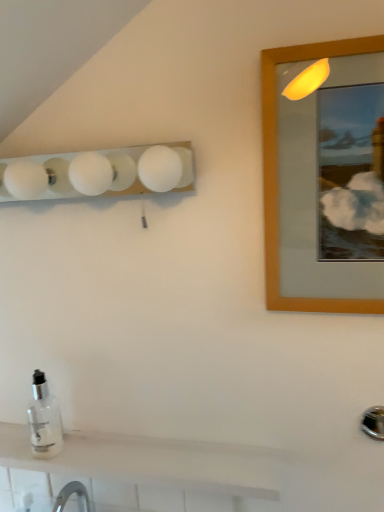
Question: Considering the relative sizes of wooden-framed mirror at upper right and white frosted glass light fixture at upper left in the image provided, is wooden-framed mirror at upper right taller than white frosted glass light fixture at upper left?

Choices:
 (A) yes
 (B) no

Answer: (A)

Question: Is wooden-framed mirror at upper right positioned with its back to white frosted glass light fixture at upper left?

Choices:
 (A) yes
 (B) no

Answer: (B)

Question: Can white frosted glass light fixture at upper left be found inside wooden-framed mirror at upper right?

Choices:
 (A) no
 (B) yes

Answer: (A)

Question: Is wooden-framed mirror at upper right at the left side of white frosted glass light fixture at upper left?

Choices:
 (A) no
 (B) yes

Answer: (A)

Question: Are wooden-framed mirror at upper right and white frosted glass light fixture at upper left located far from each other?

Choices:
 (A) no
 (B) yes

Answer: (A)

Question: From the image's perspective, is wooden-framed mirror at upper right under white frosted glass light fixture at upper left?

Choices:
 (A) yes
 (B) no

Answer: (A)

Question: Is clear glass bottle at lower left wider than wooden-framed mirror at upper right?

Choices:
 (A) yes
 (B) no

Answer: (A)

Question: From a real-world perspective, is clear glass bottle at lower left on wooden-framed mirror at upper right?

Choices:
 (A) no
 (B) yes

Answer: (A)

Question: From the image's perspective, is clear glass bottle at lower left located above wooden-framed mirror at upper right?

Choices:
 (A) yes
 (B) no

Answer: (B)

Question: Would you say clear glass bottle at lower left is a long distance from wooden-framed mirror at upper right?

Choices:
 (A) yes
 (B) no

Answer: (B)

Question: Can you see clear glass bottle at lower left touching wooden-framed mirror at upper right?

Choices:
 (A) no
 (B) yes

Answer: (A)

Question: Considering the relative sizes of clear glass bottle at lower left and wooden-framed mirror at upper right in the image provided, is clear glass bottle at lower left shorter than wooden-framed mirror at upper right?

Choices:
 (A) yes
 (B) no

Answer: (A)

Question: Is white glossy tile at lower left wider than white frosted glass light fixture at upper left?

Choices:
 (A) yes
 (B) no

Answer: (B)